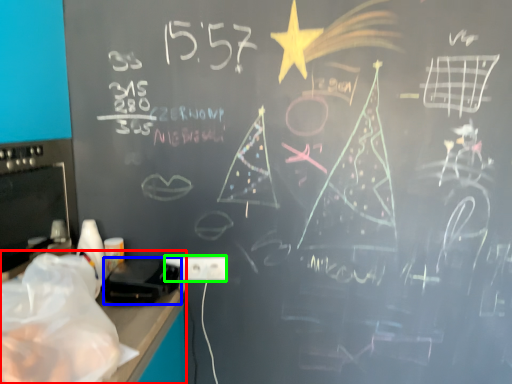
Question: Considering the real-world distances, which object is farthest from computer desk (highlighted by a red box)? equipment (highlighted by a blue box) or electric outlet (highlighted by a green box)?

Choices:
 (A) equipment
 (B) electric outlet

Answer: (B)